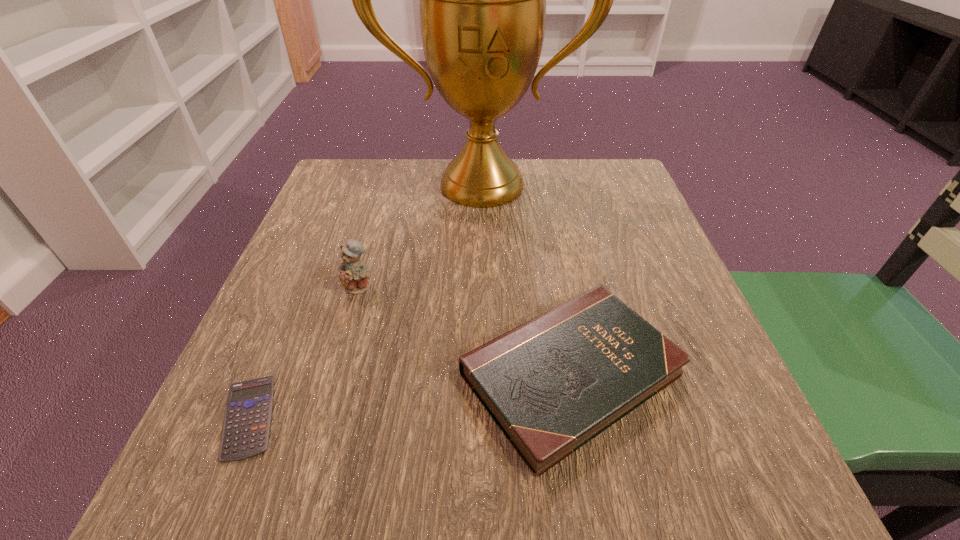
You are a GUI agent. You are given a task and a screenshot of the screen. Output one action in this format:
    pyautogui.click(x=<x>, y=<y>)
    Task: Click on the free space between the farthest object and the Bible
    
    Given the screenshot: What is the action you would take?
    pyautogui.click(x=526, y=279)

Identify the location of free spot between the Bible and the trophy cup. This screenshot has width=960, height=540. (526, 279).

What are the coordinates of `free spot between the teddy bear and the farthest object` in the screenshot? It's located at tap(420, 236).

I want to click on blank region between the second tallest object and the trophy cup, so click(x=420, y=236).

At what (x,y) coordinates should I click in order to perform the action: click on free spot between the Bible and the teddy bear. Please return your answer as a coordinate pair (x, y). Image resolution: width=960 pixels, height=540 pixels. Looking at the image, I should click on (465, 330).

This screenshot has width=960, height=540. What are the coordinates of `free space between the trophy cup and the Bible` in the screenshot? It's located at (526, 279).

This screenshot has width=960, height=540. I want to click on free point between the third tallest object and the second tallest object, so 465,330.

This screenshot has width=960, height=540. Identify the location of free space between the Bible and the shortest object. (410, 395).

Locate which object ranks in proximity to the shortest object. Please provide its 2D coordinates. Your answer should be formatted as a tuple, i.e. [(x, y)], where the tuple contains the x and y coordinates of a point satisfying the conditions above.

[(354, 274)]

Identify the location of object that is the third closest to the Bible. The width and height of the screenshot is (960, 540). (482, 0).